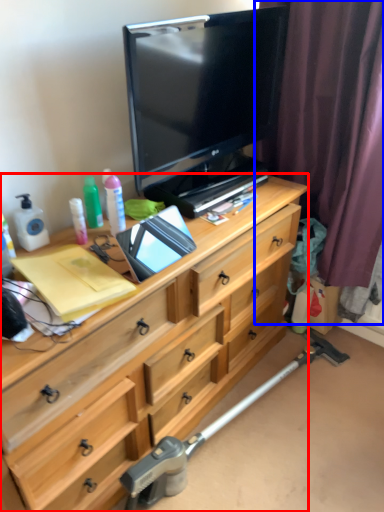
Question: Which of the following is the farthest to the observer, chest of drawers (highlighted by a red box) or curtain (highlighted by a blue box)?

Choices:
 (A) chest of drawers
 (B) curtain

Answer: (B)